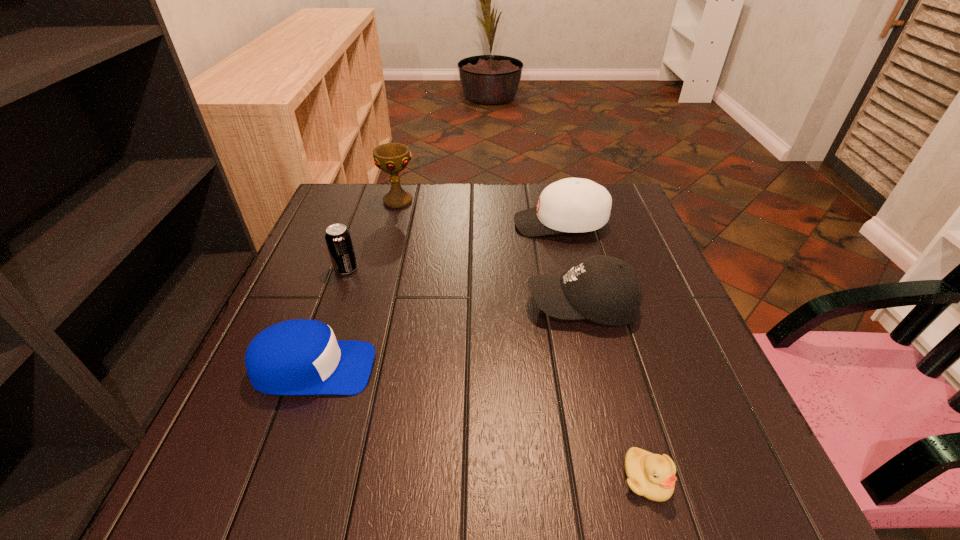
Locate an element on the screen. The height and width of the screenshot is (540, 960). chalice that is at the left edge is located at coordinates (392, 158).

Find the location of a particular element. soda can present at the left edge is located at coordinates (338, 239).

Locate an element on the screen. The width and height of the screenshot is (960, 540). baseball cap that is at the left edge is located at coordinates (295, 357).

At what (x,y) coordinates should I click in order to perform the action: click on duckling at the right edge. Please return your answer as a coordinate pair (x, y). The width and height of the screenshot is (960, 540). Looking at the image, I should click on (650, 475).

Image resolution: width=960 pixels, height=540 pixels. Find the location of `object at the far left corner`. object at the far left corner is located at coordinates (392, 158).

At what (x,y) coordinates should I click in order to perform the action: click on object at the far right corner. Please return your answer as a coordinate pair (x, y). Image resolution: width=960 pixels, height=540 pixels. Looking at the image, I should click on (574, 205).

Identify the location of object that is at the near right corner. Image resolution: width=960 pixels, height=540 pixels. (650, 475).

Where is `free region at the far edge of the desktop`? Image resolution: width=960 pixels, height=540 pixels. free region at the far edge of the desktop is located at coordinates (421, 228).

The image size is (960, 540). What are the coordinates of `vacant point at the near edge` in the screenshot? It's located at (427, 482).

Where is `vacant area at the left edge of the desktop`? The height and width of the screenshot is (540, 960). vacant area at the left edge of the desktop is located at coordinates (262, 415).